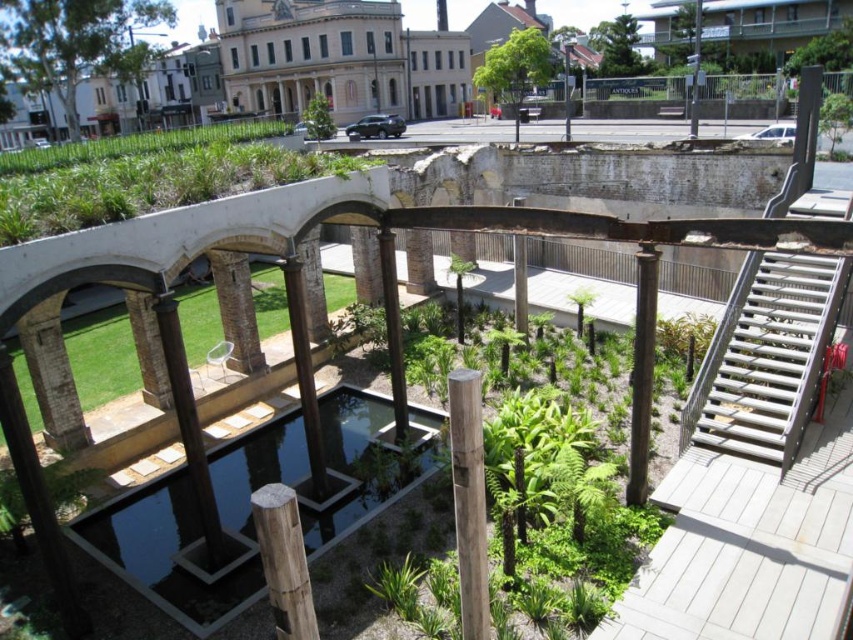
You are standing in the park and want to take a photo of the green grass at upper center without the metallic silver stairs at right appearing in the frame. How should you position yourself?

Move closer to the green grass at upper center so that the metallic silver stairs at right are out of the frame since the metallic silver stairs at right are further away from you than the green grass at upper center.

You are a visitor standing at the entrance of the park and want to take a photo of the wooden post at center and the green grass at upper center. Which object will appear closer to the camera in your photo?

The green grass at upper center will appear closer to the camera because the wooden post at center is behind it.

You are a landscape architect planning to install a new water fountain in the park. The fountain requires a space of at least 20 meters between the green grass at upper center and the green leafy plant at center for proper placement. Based on the scene description, can the fountain be placed between these two points?

The green grass at upper center and green leafy plant at center are 21.16 meters apart, which exceeds the required 20 meters. Therefore, the fountain can be placed between these two points as there is sufficient space.